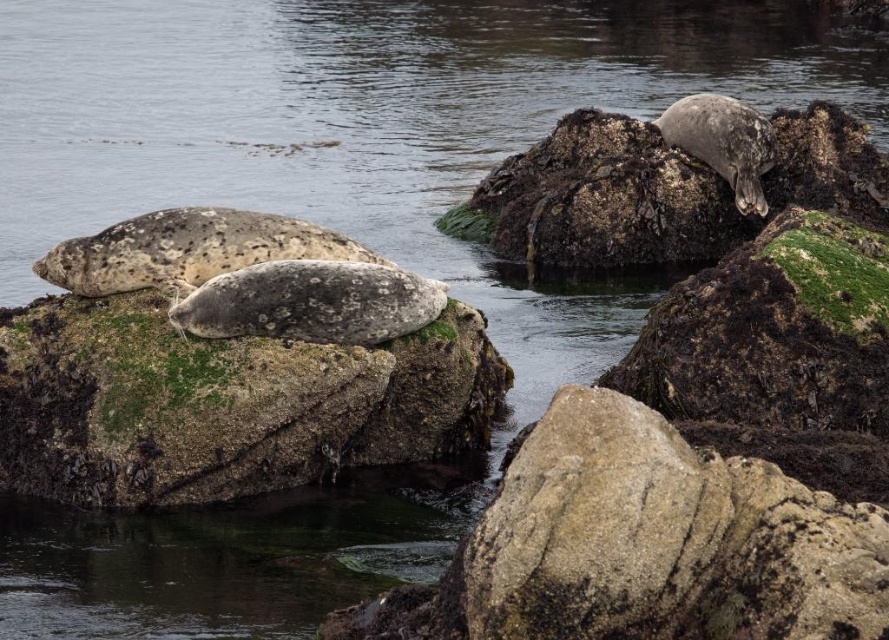
Question: Does speckled gray rock at center appear on the right side of speckled fur seal at center?

Choices:
 (A) yes
 (B) no

Answer: (B)

Question: Which point appears farthest from the camera in this image?

Choices:
 (A) (390, 385)
 (B) (327, 284)

Answer: (A)

Question: Among these points, which one is nearest to the camera?

Choices:
 (A) (7, 442)
 (B) (753, 122)
 (C) (415, 308)

Answer: (C)

Question: Is speckled fur seal at center above speckled fur seal at upper right?

Choices:
 (A) yes
 (B) no

Answer: (B)

Question: Is speckled gray rock at upper right further to the viewer compared to speckled fur seal at upper right?

Choices:
 (A) yes
 (B) no

Answer: (B)

Question: Which point is closer to the camera?

Choices:
 (A) speckled gray rock at center
 (B) speckled fur seal at upper right
 (C) speckled gray rock at upper right
 (D) speckled fur seal at center

Answer: (A)